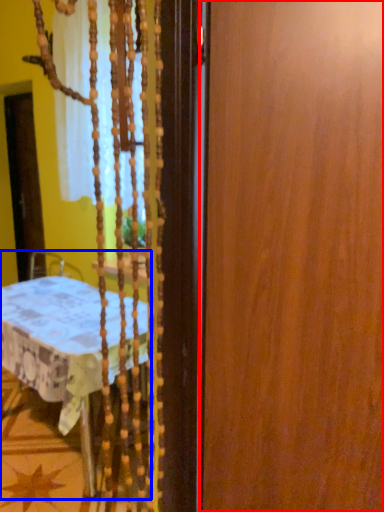
Question: Among these objects, which one is farthest to the camera, barn door (highlighted by a red box) or furniture (highlighted by a blue box)?

Choices:
 (A) barn door
 (B) furniture

Answer: (B)